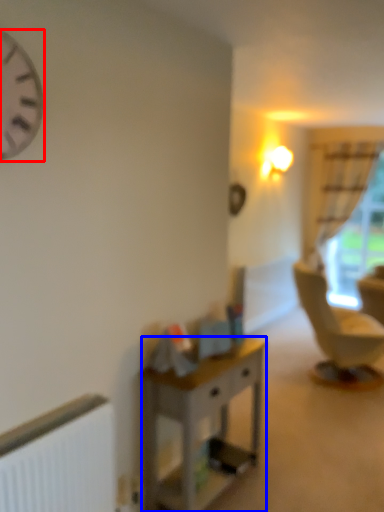
Question: Which object appears closest to the camera in this image, clock (highlighted by a red box) or desk (highlighted by a blue box)?

Choices:
 (A) clock
 (B) desk

Answer: (A)